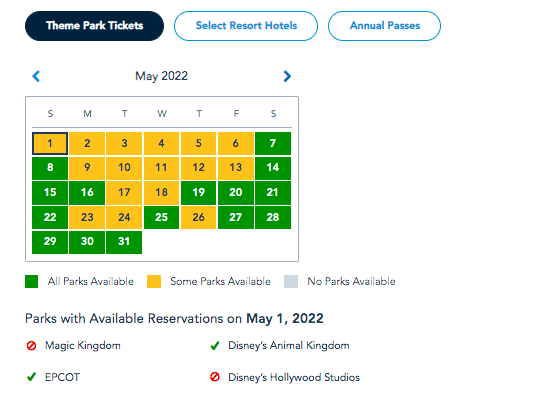
At what (x,y) coordinates should I click in order to perform the action: click on calendar. Please return your answer as a coordinate pair (x, y). Image resolution: width=557 pixels, height=400 pixels. Looking at the image, I should click on (182, 101).